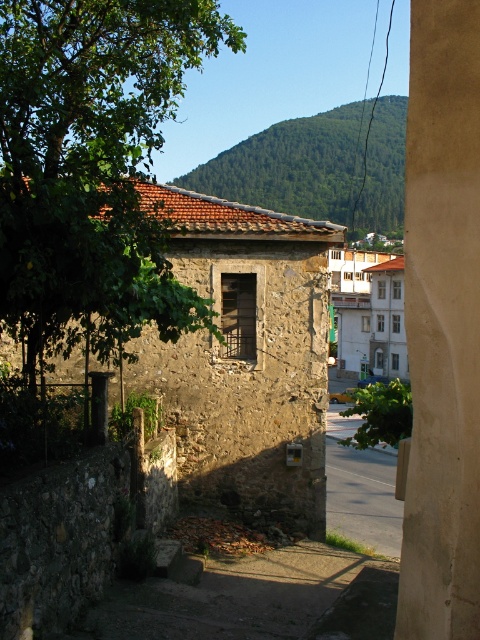
Which is more to the right, green leafy tree at upper left or asphalt road at lower center?

asphalt road at lower center is more to the right.

Which is behind, point (167, 339) or point (325, 442)?

The point (325, 442) is behind.

Find the location of `green leafy tree at upper left`. green leafy tree at upper left is located at coordinates (x=92, y=166).

The width and height of the screenshot is (480, 640). I want to click on green leafy tree at upper left, so click(x=92, y=166).

Can you confirm if green leafy tree at upper left is shorter than green forested hill at upper center?

Correct, green leafy tree at upper left is not as tall as green forested hill at upper center.

Does green leafy tree at upper left appear on the right side of green forested hill at upper center?

In fact, green leafy tree at upper left is to the left of green forested hill at upper center.

Between point (49, 234) and point (367, 214), which one is positioned behind?

The point (367, 214) is more distant.

I want to click on green leafy tree at upper left, so click(92, 166).

Describe the element at coordinates (319, 168) in the screenshot. I see `green forested hill at upper center` at that location.

Is green forested hill at upper center bigger than asphalt road at lower center?

Indeed, green forested hill at upper center has a larger size compared to asphalt road at lower center.

The image size is (480, 640). What are the coordinates of `green forested hill at upper center` in the screenshot? It's located at (319, 168).